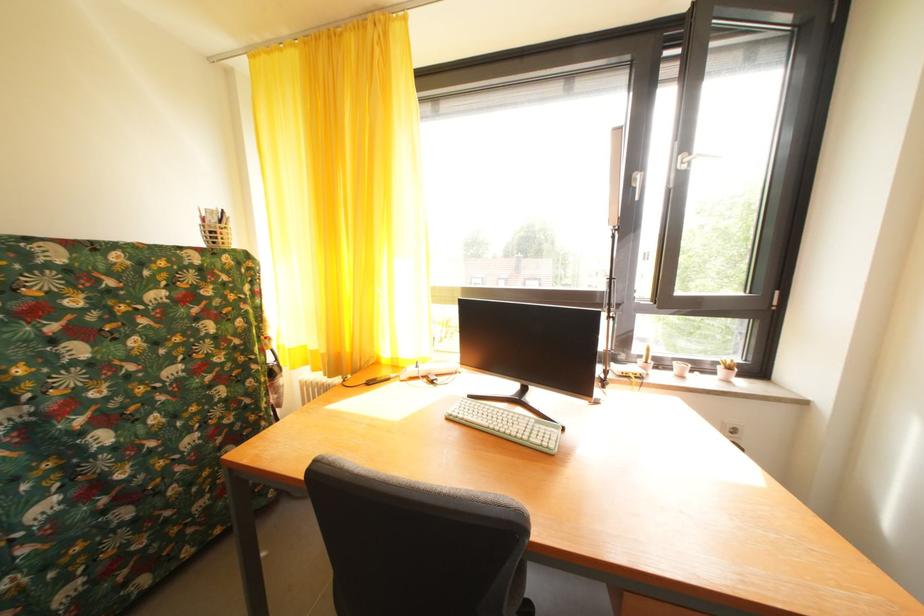
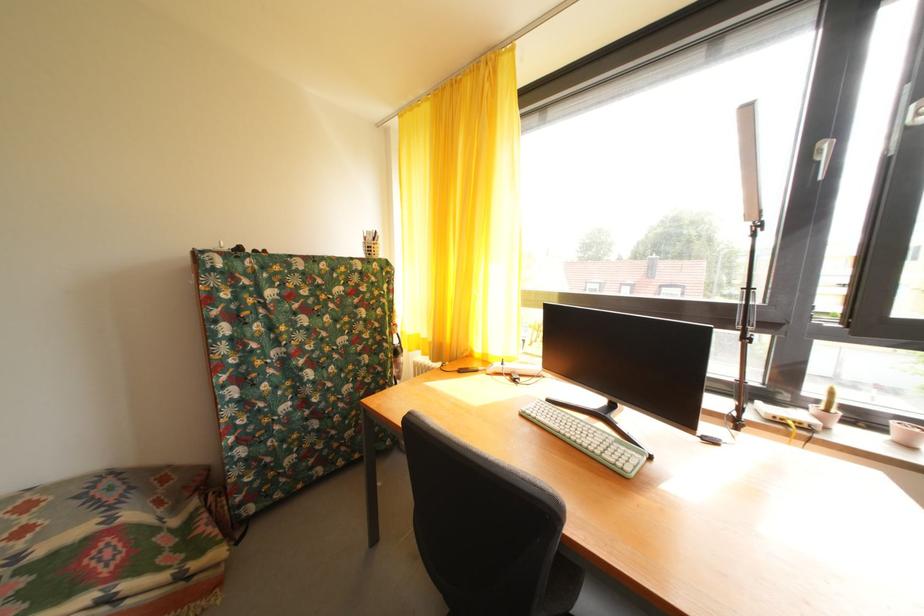
Where in the second image is the point corresponding to the point at 655,368 from the first image?

(836, 416)